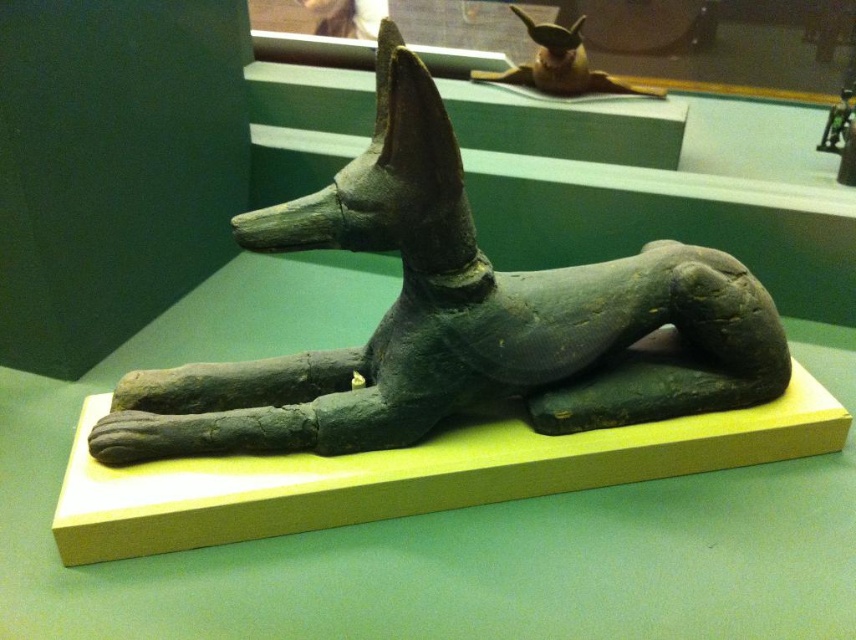
Question: Does matte black statue at center come behind shiny gold statue at upper center?

Choices:
 (A) no
 (B) yes

Answer: (A)

Question: Observing the image, what is the correct spatial positioning of matte black statue at center in reference to shiny gold statue at upper center?

Choices:
 (A) right
 (B) left

Answer: (B)

Question: Among these points, which one is farthest from the camera?

Choices:
 (A) (575, 93)
 (B) (465, 362)

Answer: (A)

Question: Among these points, which one is nearest to the camera?

Choices:
 (A) (395, 385)
 (B) (587, 80)

Answer: (A)

Question: Is matte black statue at center closer to the viewer compared to shiny gold statue at upper center?

Choices:
 (A) yes
 (B) no

Answer: (A)